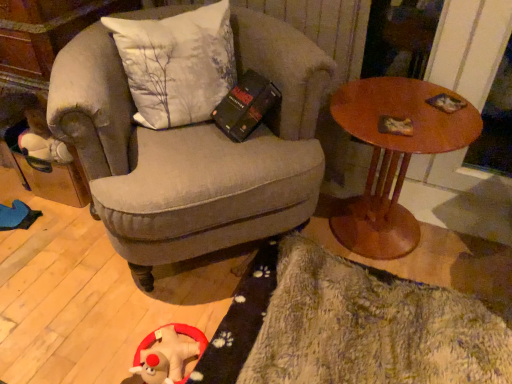
Find the location of a particular element. The width and height of the screenshot is (512, 384). free space to the back side of fuzzy plush toy at lower left is located at coordinates (164, 314).